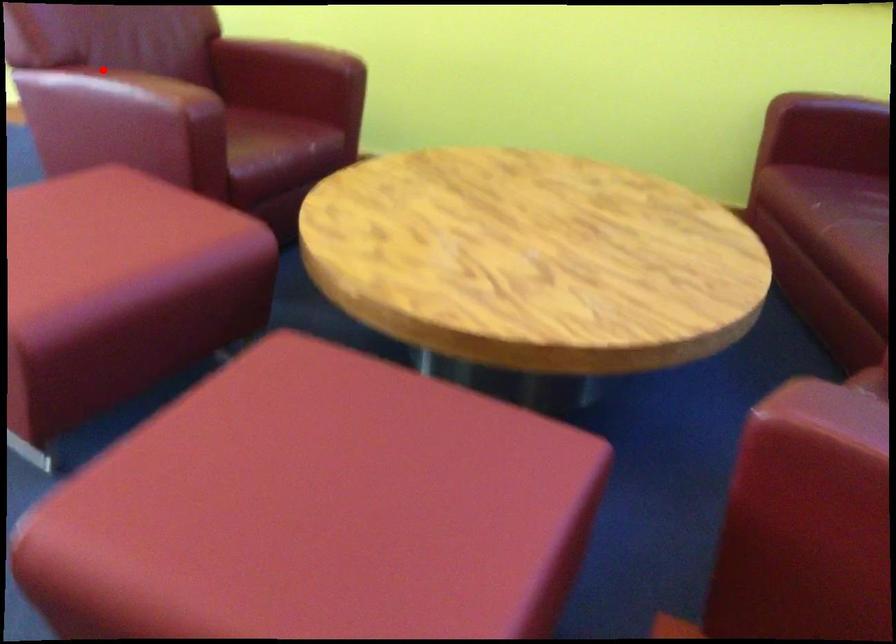
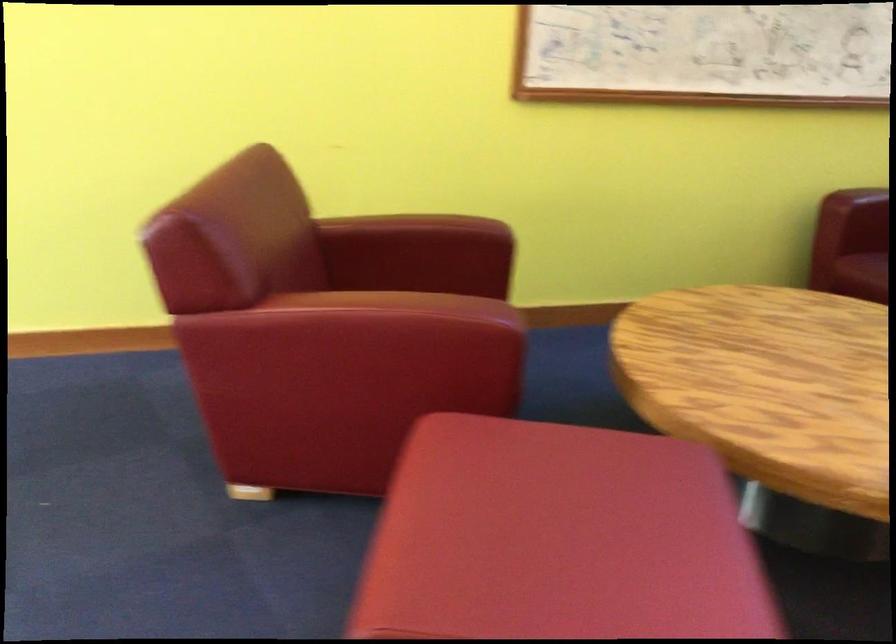
Question: I am providing you with two images of the same scene from different viewpoints. Image1 has a red point marked. In image2, the corresponding 3D location appears at what relative position? Reply with the corresponding letter.

Choices:
 (A) Closer
 (B) Farther

Answer: (A)